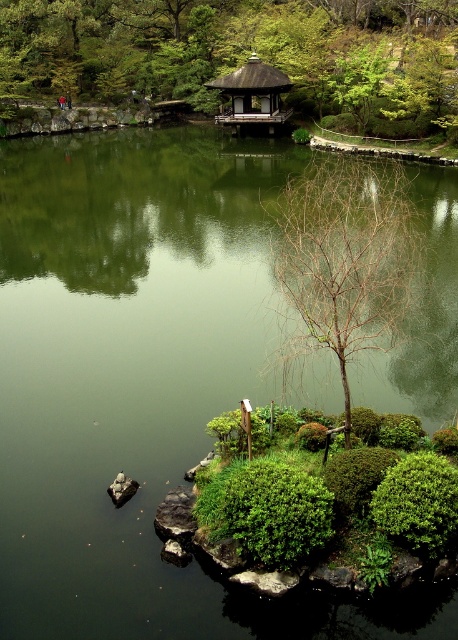
Can you confirm if bare branches at center is shorter than shiny dark brown gazebo at upper center?

No, bare branches at center is not shorter than shiny dark brown gazebo at upper center.

Between point (390, 243) and point (283, 86), which one is positioned in front?

Positioned in front is point (390, 243).

Image resolution: width=458 pixels, height=640 pixels. Identify the location of bare branches at center. (345, 259).

Can you confirm if bare branches at center is bigger than smooth gray rock at lower left?

Yes.

Between point (341, 374) and point (132, 480), which one is positioned behind?

The point (132, 480) is behind.

The height and width of the screenshot is (640, 458). In order to click on bare branches at center in this screenshot , I will do `click(345, 259)`.

Who is positioned more to the left, shiny dark brown gazebo at upper center or smooth gray rock at lower left?

From the viewer's perspective, smooth gray rock at lower left appears more on the left side.

Based on the photo, does shiny dark brown gazebo at upper center have a greater width compared to smooth gray rock at lower left?

Yes, shiny dark brown gazebo at upper center is wider than smooth gray rock at lower left.

Where is `shiny dark brown gazebo at upper center`? This screenshot has width=458, height=640. shiny dark brown gazebo at upper center is located at coordinates (252, 93).